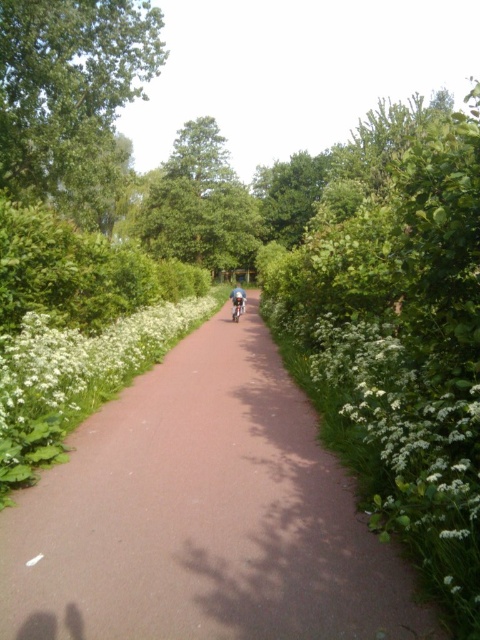
Which is more to the right, pink asphalt trail at center or shiny blue bicycle at center?

pink asphalt trail at center is more to the right.

Does pink asphalt trail at center appear over shiny blue bicycle at center?

Actually, pink asphalt trail at center is below shiny blue bicycle at center.

Locate an element on the screen. pink asphalt trail at center is located at coordinates (203, 515).

Image resolution: width=480 pixels, height=640 pixels. What are the coordinates of `pink asphalt trail at center` in the screenshot? It's located at (203, 515).

Is the position of pink asphalt trail at center less distant than that of green leafy tree at center?

Yes.

Who is more forward, [147,612] or [223,145]?

Point [147,612]

Locate an element on the screen. This screenshot has height=640, width=480. pink asphalt trail at center is located at coordinates (203, 515).

Does point (85, 116) come behind point (239, 300)?

No, it is not.

Does green leafy tree at upper left have a lesser height compared to shiny blue bicycle at center?

No, green leafy tree at upper left is not shorter than shiny blue bicycle at center.

Does point (87, 40) lie in front of point (237, 289)?

Yes, it is.

At what (x,y) coordinates should I click in order to perform the action: click on green leafy tree at upper left. Please return your answer as a coordinate pair (x, y). The width and height of the screenshot is (480, 640). Looking at the image, I should click on (71, 97).